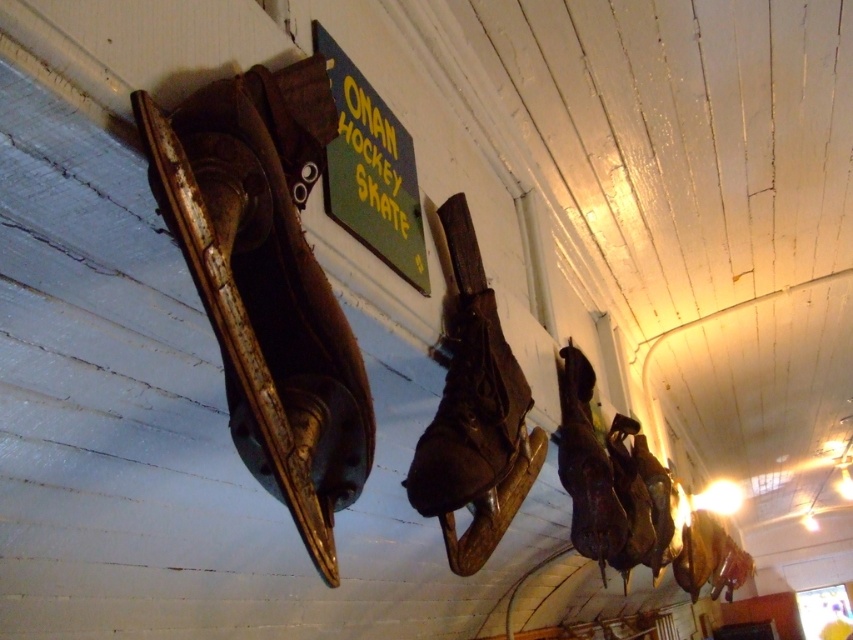
Is leather at left bigger than brown leather skate at center?

Indeed, leather at left has a larger size compared to brown leather skate at center.

Measure the distance between leather at left and brown leather skate at center.

leather at left and brown leather skate at center are 24.01 inches apart.

Which is in front, point (316, 556) or point (463, 204)?

Point (316, 556) is more forward.

Where is `leather at left`? leather at left is located at coordinates (268, 284).